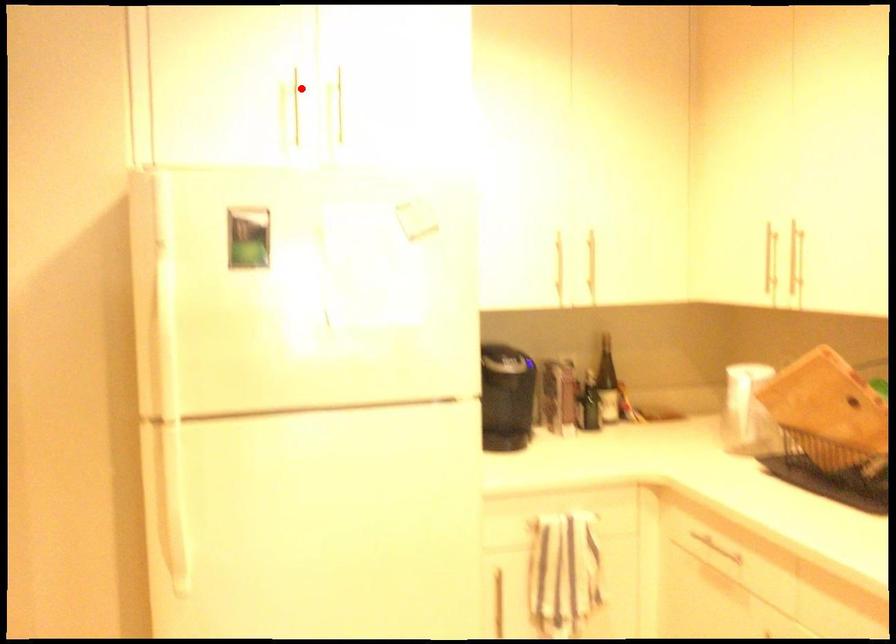
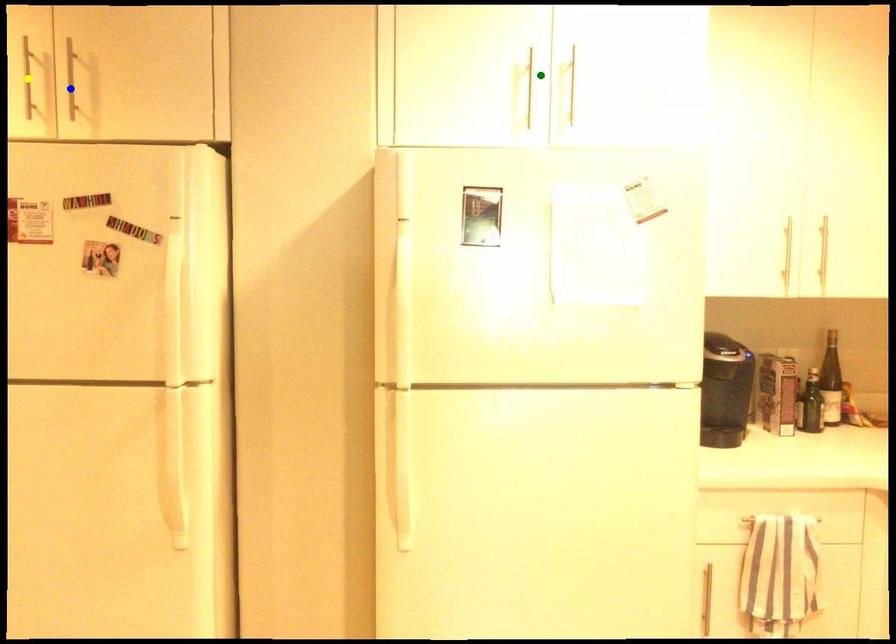
Question: I am providing you with two images of the same scene from different viewpoints. A red point is marked on the first image. You are given multiple points on the second image. Which point in image 2 is actually the same real-world point as the red point in image 1?

Choices:
 (A) yellow point
 (B) blue point
 (C) green point

Answer: (C)